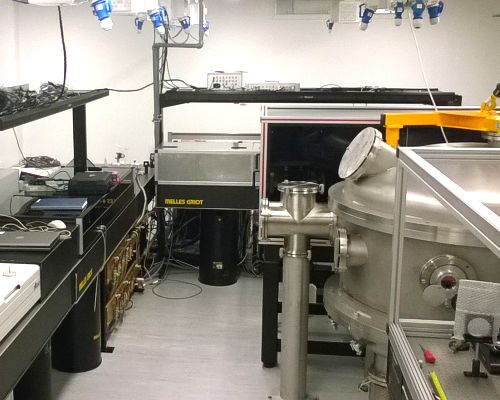
Locate an element on the screen. gray floor is located at coordinates (158, 358).